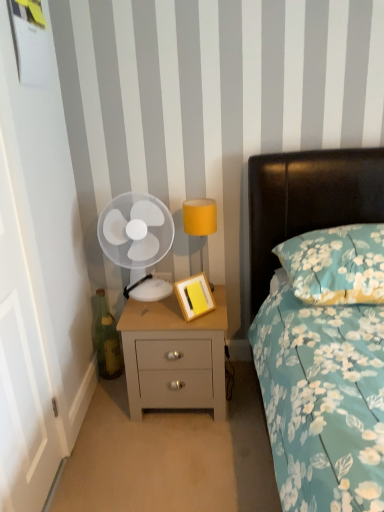
Question: In terms of height, does green glass bottle at lower left look taller or shorter compared to light gray wood nightstand at center?

Choices:
 (A) short
 (B) tall

Answer: (A)

Question: Based on their positions, is green glass bottle at lower left located to the left or right of light gray wood nightstand at center?

Choices:
 (A) right
 (B) left

Answer: (B)

Question: Based on their relative distances, which object is nearer to the floral fabric pillow at upper right?

Choices:
 (A) wooden picture frame at center
 (B) white plastic fan at left
 (C) yellow fabric lampshade at upper right
 (D) green glass bottle at lower left
 (E) light gray wood nightstand at center

Answer: (A)

Question: Estimate the real-world distances between objects in this image. Which object is closer to the wooden picture frame at center?

Choices:
 (A) white plastic fan at left
 (B) light gray wood nightstand at center
 (C) floral fabric pillow at upper right
 (D) yellow fabric lampshade at upper right
 (E) green glass bottle at lower left

Answer: (B)